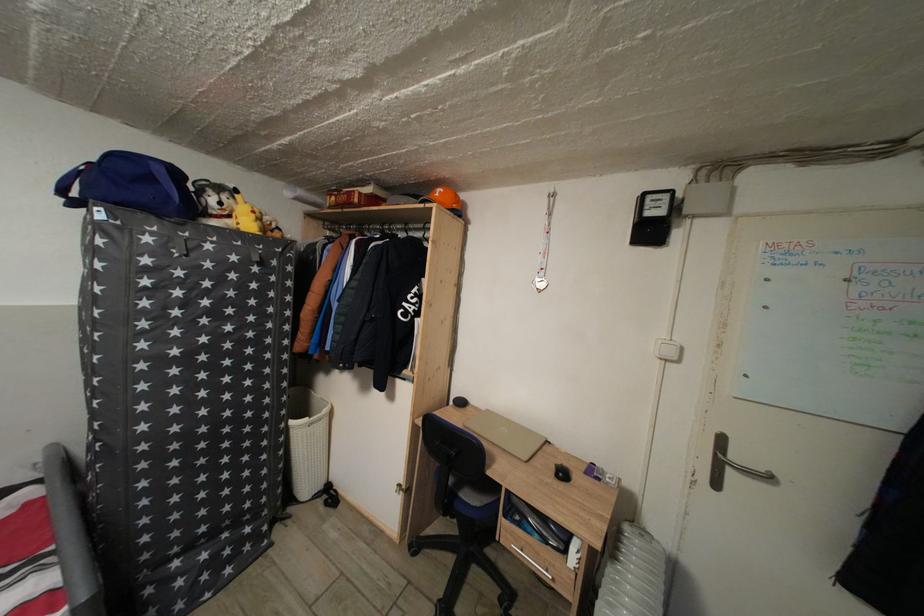
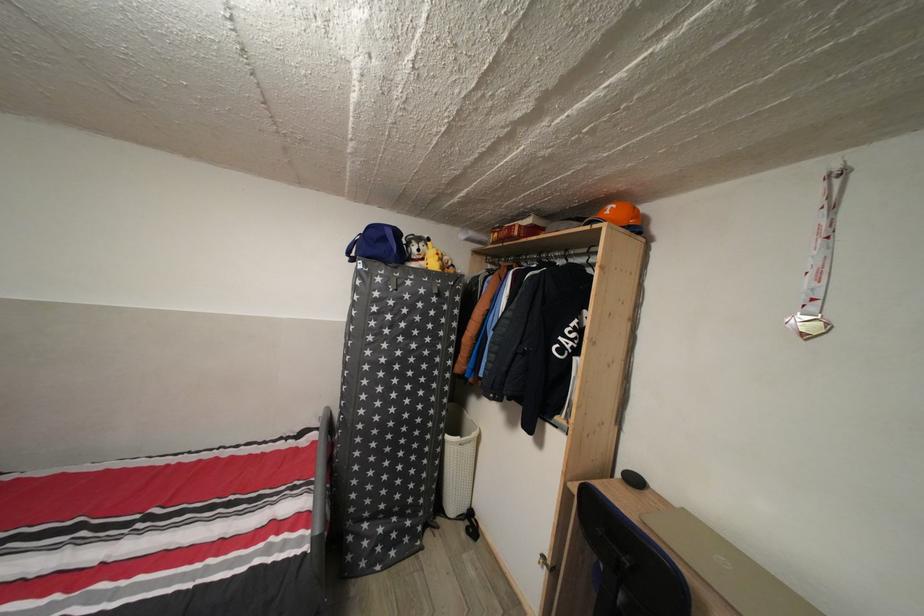
The point at [261,223] is marked in the first image. Where is the corresponding point in the second image?

(444, 264)